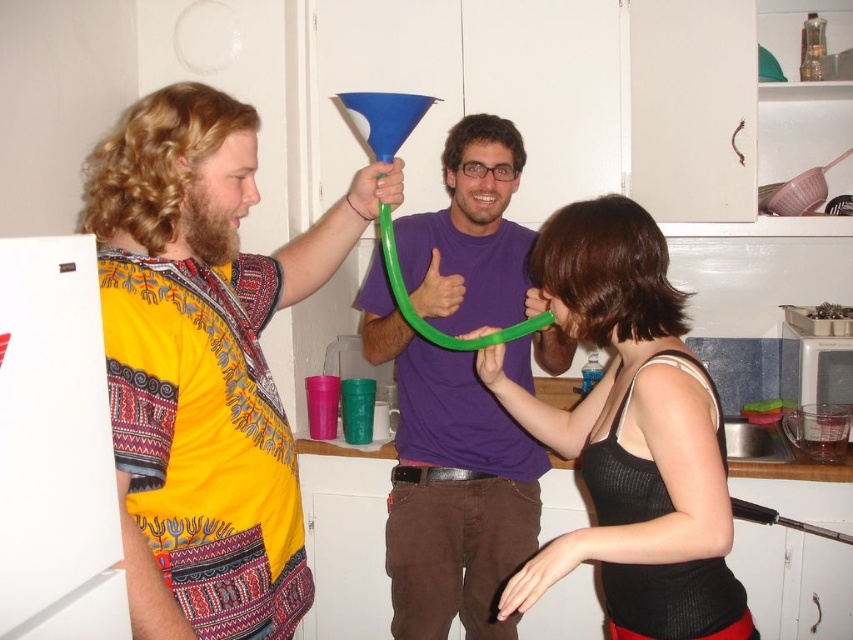
Between matte yellow shirt at center and black ribbed tank top at center, which one has less height?

Standing shorter between the two is black ribbed tank top at center.

What do you see at coordinates (204, 364) in the screenshot? I see `matte yellow shirt at center` at bounding box center [204, 364].

I want to click on matte yellow shirt at center, so click(204, 364).

Who is lower down, black ribbed tank top at center or purple matte shirt at center?

black ribbed tank top at center

Measure the distance between black ribbed tank top at center and camera.

The distance of black ribbed tank top at center from camera is 1.21 meters.

Where is `black ribbed tank top at center`? The width and height of the screenshot is (853, 640). black ribbed tank top at center is located at coordinates (630, 435).

Who is lower down, matte yellow shirt at center or purple matte shirt at center?

purple matte shirt at center

Does matte yellow shirt at center appear over purple matte shirt at center?

Indeed, matte yellow shirt at center is positioned over purple matte shirt at center.

Between point (125, 467) and point (488, 540), which one is positioned behind?

The point (488, 540) is behind.

The width and height of the screenshot is (853, 640). In order to click on matte yellow shirt at center in this screenshot , I will do `click(204, 364)`.